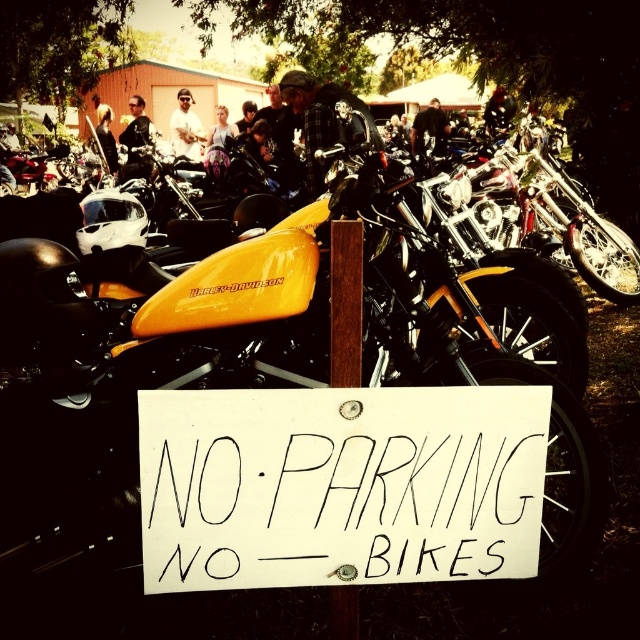
You are standing in front of the Harley motorcycle and want to place two stickers on the wooden post. The first sticker should be placed at point (280, 464) and the second at point (340, 596). Which sticker will appear higher on the post when viewed from your position?

The sticker at point (280, 464) will appear higher on the post because it is closer to the viewer than point (340, 596).

You are a delivery person who needs to read the sign on the wooden post at center. Can you see the white paper sign at center clearly from where you are standing?

The white paper sign at center is bigger than wooden post at center, so yes, you can see the white paper sign at center clearly from where you are standing.